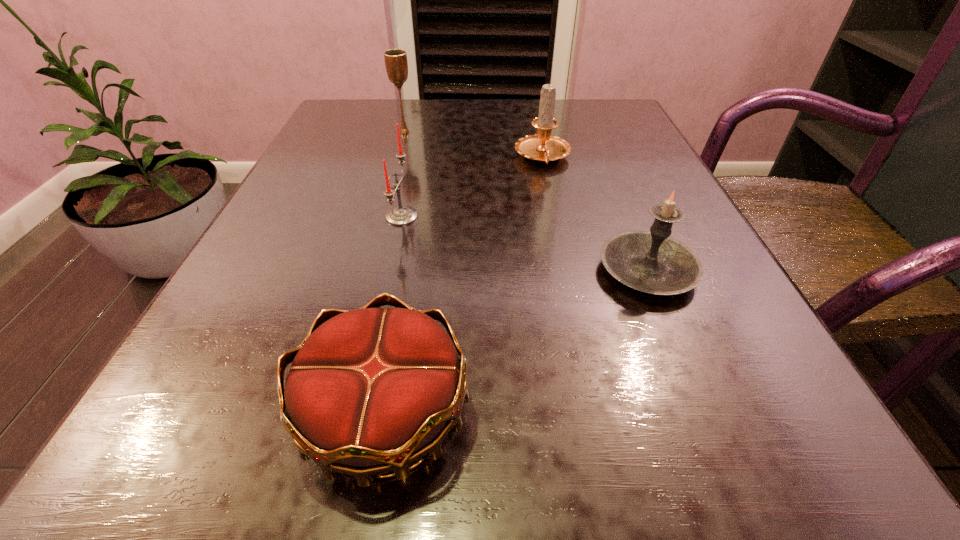
Find the location of `the farthest object`. the farthest object is located at coordinates (396, 63).

The width and height of the screenshot is (960, 540). I want to click on the farthest candle, so click(542, 147).

The height and width of the screenshot is (540, 960). I want to click on the leftmost candle, so click(401, 215).

The height and width of the screenshot is (540, 960). I want to click on the nearest object, so click(371, 390).

Locate an element on the screen. The width and height of the screenshot is (960, 540). the shortest object is located at coordinates point(371,390).

The image size is (960, 540). Find the location of `vacant point located on the right of the farthest object`. vacant point located on the right of the farthest object is located at coordinates (485, 132).

Locate an element on the screen. This screenshot has height=540, width=960. vacant space located on the left of the farthest candle is located at coordinates (351, 158).

Find the location of a particular element. Image resolution: width=960 pixels, height=540 pixels. vacant space positioned 0.370m on the front-facing side of the leftmost candle is located at coordinates (644, 217).

Locate an element on the screen. The height and width of the screenshot is (540, 960). vacant space located on the back of the shortest object is located at coordinates (420, 208).

Identify the location of chalice located at the far edge. The height and width of the screenshot is (540, 960). (396, 63).